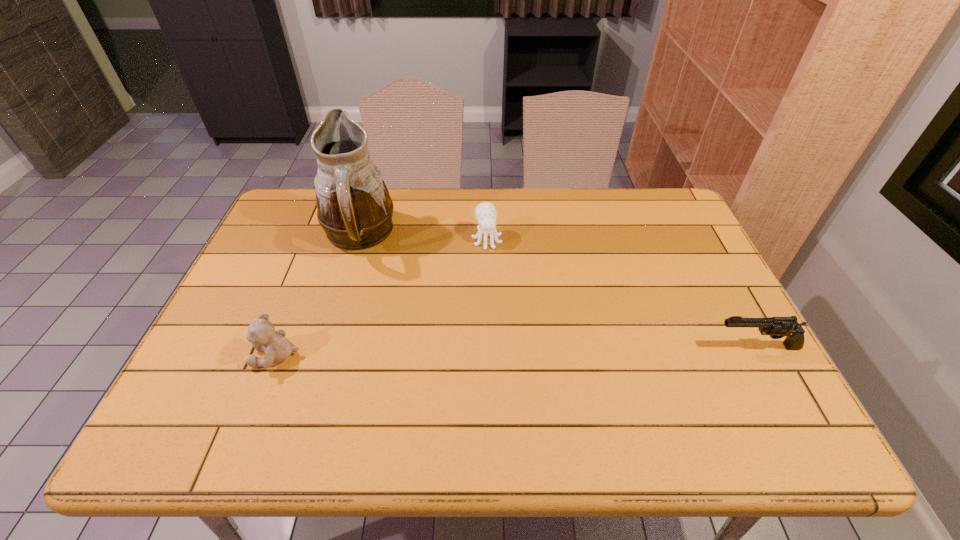
You are a GUI agent. You are given a task and a screenshot of the screen. Output one action in this format:
    pyautogui.click(x=<x>, y=<y>)
    Task: Click on the object located in the right edge section of the desktop
    The image size is (960, 540).
    Given the screenshot: What is the action you would take?
    pyautogui.click(x=777, y=327)

Locate an element on the screen. object located in the near left corner section of the desktop is located at coordinates (262, 334).

You are a GUI agent. You are given a task and a screenshot of the screen. Output one action in this format:
    pyautogui.click(x=<x>, y=<y>)
    Task: Click on the vacant space at the far edge
    The image size is (960, 540).
    Given the screenshot: What is the action you would take?
    pyautogui.click(x=500, y=228)

Identify the location of free space at the near edge of the desktop. The image size is (960, 540). (371, 400).

In the image, there is a desktop. Identify the location of blank space at the left edge. (273, 321).

At what (x,y) coordinates should I click in order to perform the action: click on vacant point at the right edge. Please return your answer as a coordinate pair (x, y). Looking at the image, I should click on (698, 251).

In the image, there is a desktop. Where is `vacant space at the far right corner`? This screenshot has height=540, width=960. vacant space at the far right corner is located at coordinates (678, 214).

I want to click on vacant area between the second object from right to left and the tallest object, so click(x=422, y=238).

At what (x,y) coordinates should I click in order to perform the action: click on free area in between the octopus and the teddy bear. Please return your answer as a coordinate pair (x, y). The image size is (960, 540). Looking at the image, I should click on (381, 298).

This screenshot has width=960, height=540. I want to click on vacant space that is in between the pitcher and the teddy bear, so click(318, 296).